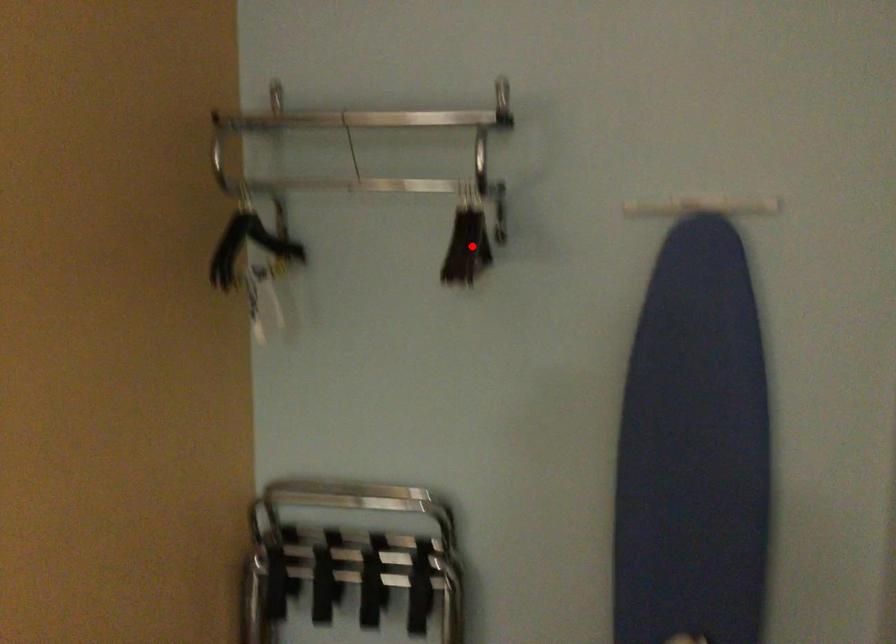
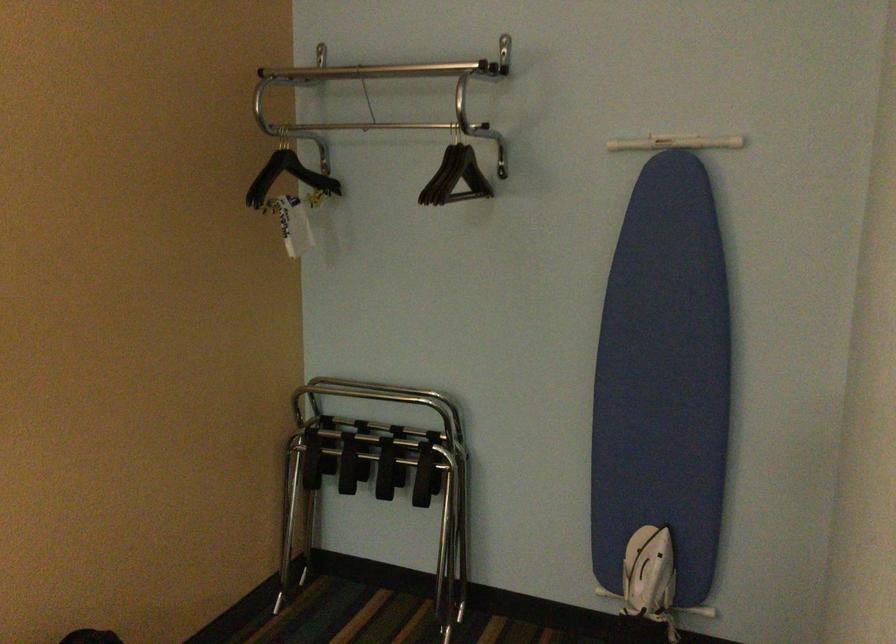
Question: I am providing you with two images of the same scene from different viewpoints. Given a red point in image1, look at the same physical point in image2. Is it:

Choices:
 (A) Closer to the viewpoint
 (B) Farther from the viewpoint

Answer: (B)